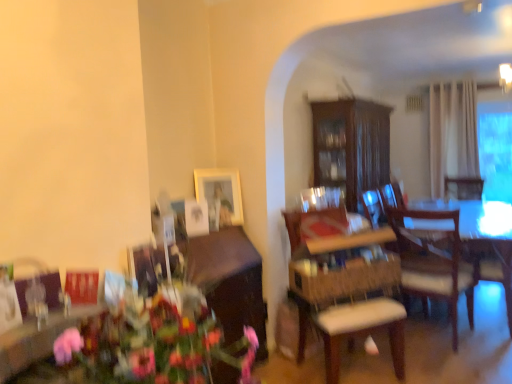
Identify the location of free location above transparent glass window at right (from a real-world perspective). (489, 105).